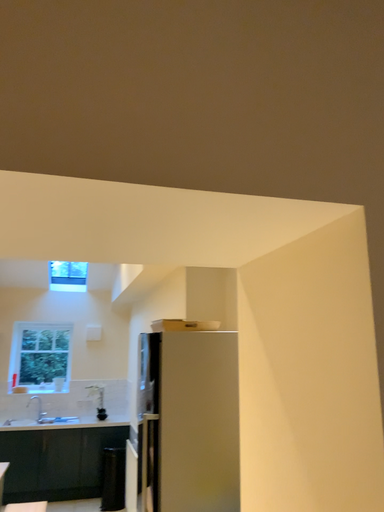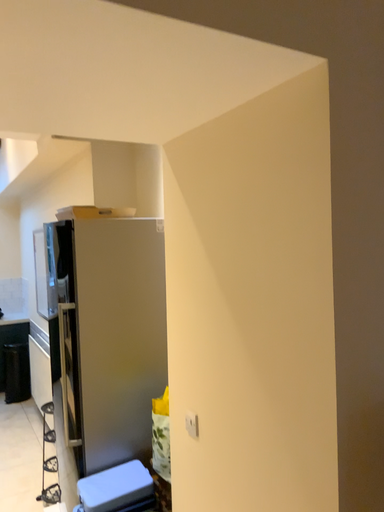
Question: Which way did the camera rotate in the video?

Choices:
 (A) rotated upward
 (B) rotated downward

Answer: (B)